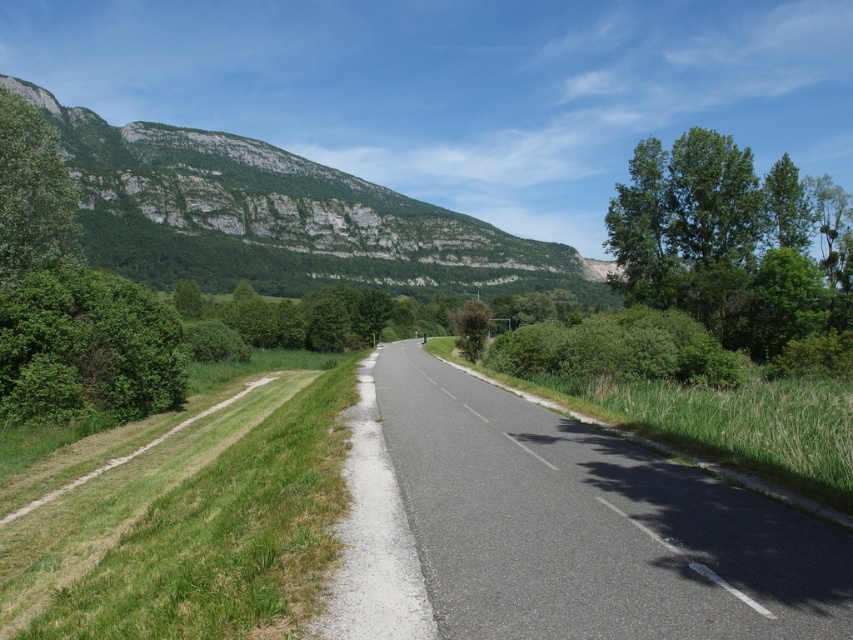
Question: Which object is farther from the camera taking this photo?

Choices:
 (A) green leafy tree at upper right
 (B) green leafy bush at left
 (C) asphalt road at center
 (D) green rock mountain at upper left

Answer: (D)

Question: Is asphalt road at center below green leafy tree at upper left?

Choices:
 (A) yes
 (B) no

Answer: (A)

Question: Which object is positioned closest to the green rock mountain at upper left?

Choices:
 (A) green leafy bush at left
 (B) green leafy tree at upper left

Answer: (A)

Question: Which point appears farthest from the camera in this image?

Choices:
 (A) (175, 378)
 (B) (527, 470)
 (C) (169, 156)
 (D) (48, 246)

Answer: (C)

Question: Can you confirm if asphalt road at center is positioned below green leafy bush at left?

Choices:
 (A) yes
 (B) no

Answer: (A)

Question: Is green leafy bush at left positioned behind green leafy tree at upper left?

Choices:
 (A) yes
 (B) no

Answer: (B)